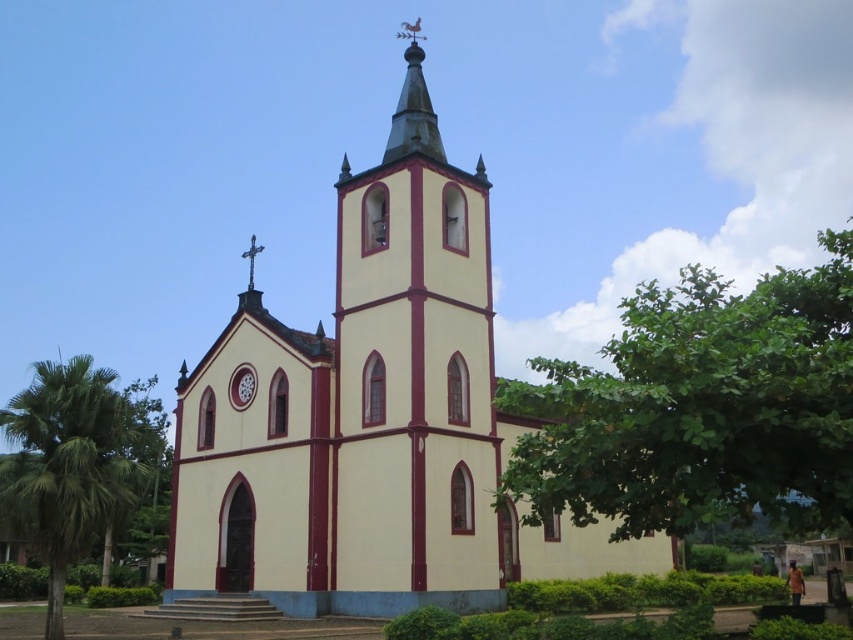
You are standing in front of the church and notice a green leafy tree at right and a matte red clock at center. Which object is closer to the bell tower?

The matte red clock at center is closer to the bell tower because it is positioned under the green leafy tree at right.

You are standing in front of the beige stucco church at center and want to take a photo of the green leafy palm tree at lower left. In which direction should you move to frame the palm tree in your camera?

The beige stucco church at center is to the right of the green leafy palm tree at lower left, so you should move to your left to frame the palm tree in your camera.